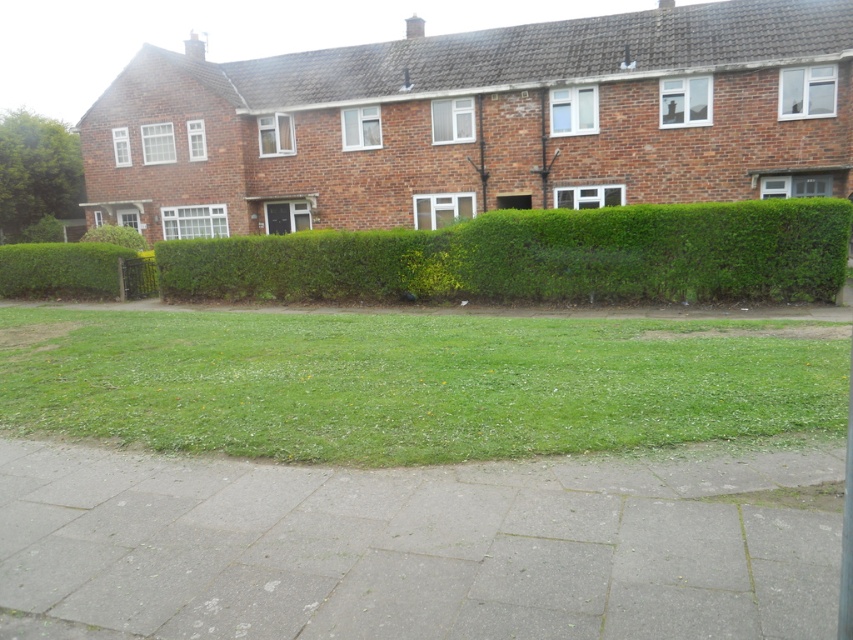
Who is more distant from viewer, (18, 266) or (115, 228)?

Positioned behind is point (115, 228).

Describe the element at coordinates (61, 269) in the screenshot. The height and width of the screenshot is (640, 853). I see `green leafy bush at left` at that location.

Where is `green leafy bush at left`? This screenshot has width=853, height=640. green leafy bush at left is located at coordinates coord(61,269).

Is point (18, 193) farther from viewer compared to point (62, 259)?

Yes, it is behind point (62, 259).

Does green leafy bush at upper left have a greater height compared to green leafy bush at left?

Correct, green leafy bush at upper left is much taller as green leafy bush at left.

I want to click on green leafy bush at upper left, so click(x=36, y=172).

Where is `green leafy bush at upper left`? This screenshot has width=853, height=640. green leafy bush at upper left is located at coordinates (36, 172).

The image size is (853, 640). What do you see at coordinates (413, 381) in the screenshot?
I see `green grass at center` at bounding box center [413, 381].

Is point (631, 323) positioned before point (86, 285)?

Yes, it is.

Where is `green grass at center`? The width and height of the screenshot is (853, 640). green grass at center is located at coordinates [x=413, y=381].